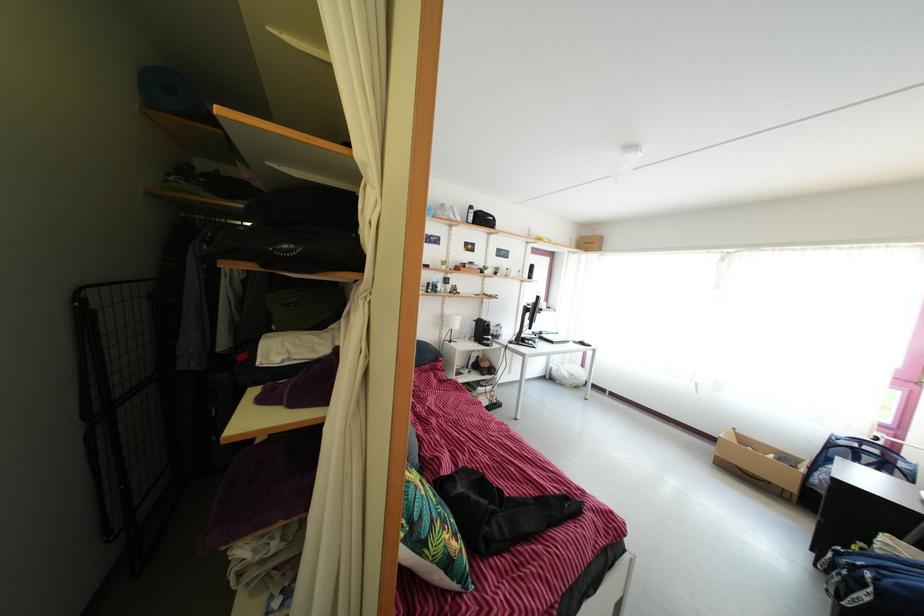
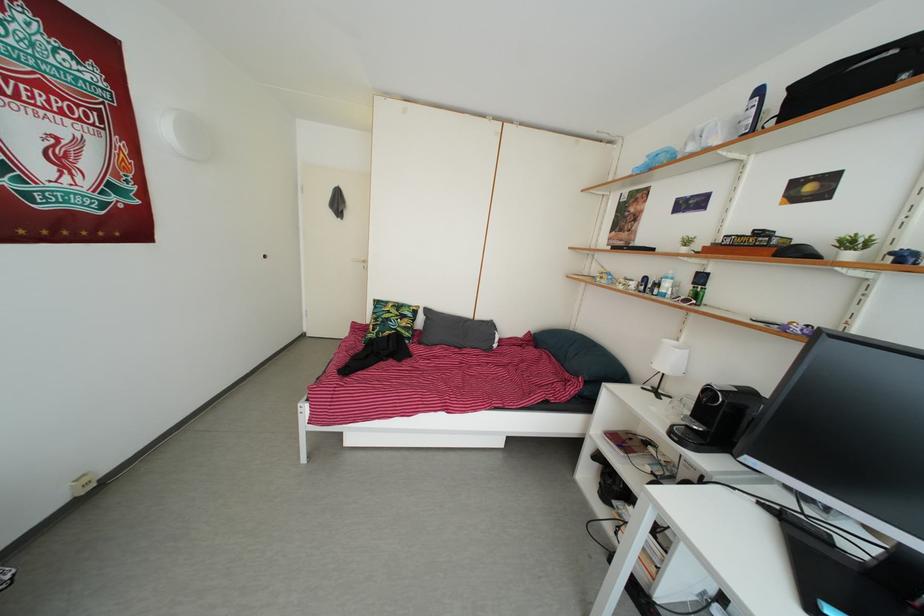
Question: I am providing you with two images of the same scene from different viewpoints. After the viewpoint changes to image2, which objects are now occluded?

Choices:
 (A) black drying rack
 (B) bed sitting surface
 (C) white door handle
 (D) red chair armrest

Answer: (A)